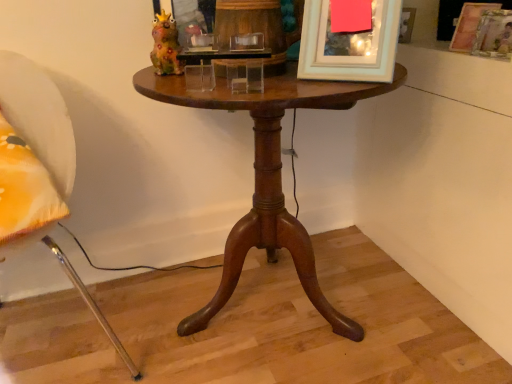
This screenshot has height=384, width=512. Describe the element at coordinates (39, 117) in the screenshot. I see `white fabric chair at left` at that location.

What do you see at coordinates (349, 44) in the screenshot?
I see `white matte picture frame at upper center, the first picture frame viewed from the left` at bounding box center [349, 44].

Measure the distance between point (x=307, y=276) and camera.

Point (x=307, y=276) and camera are 1.16 meters apart.

In order to face wooden picture frame at upper right, which is counted as the first picture frame, starting from the right, should I rotate leftwards or rightwards?

You should rotate right by 30.057 degrees.

Where is `wooden picture frame at upper right, the 3th picture frame in the front-to-back sequence`? This screenshot has width=512, height=384. wooden picture frame at upper right, the 3th picture frame in the front-to-back sequence is located at coordinates (469, 25).

This screenshot has height=384, width=512. Identify the location of white fabric chair at left. (39, 117).

Considering the relative positions of white fabric chair at left and mahogany wood table at center in the image provided, is white fabric chair at left to the right of mahogany wood table at center from the viewer's perspective?

No.

Which is correct: white fabric chair at left is inside mahogany wood table at center, or outside of it?

white fabric chair at left exists outside the volume of mahogany wood table at center.

Considering the relative sizes of white fabric chair at left and mahogany wood table at center in the image provided, is white fabric chair at left wider than mahogany wood table at center?

Yes.

Who is shorter, white fabric chair at left or mahogany wood table at center?

mahogany wood table at center is shorter.

Between wooden picture frame at upper right, the 3th picture frame in the front-to-back sequence, and wooden picture frame at upper right, arranged as the 3th picture frame when viewed from the left, which one appears on the right side from the viewer's perspective?

From the viewer's perspective, wooden picture frame at upper right, arranged as the 3th picture frame when viewed from the left, appears more on the right side.

Is wooden picture frame at upper right, the second picture frame when ordered from left to right, beside wooden picture frame at upper right, the 2th picture frame from the back?

Yes.

Looking at this image, from a real-world perspective, is wooden picture frame at upper right, which ranks as the second picture frame in right-to-left order, over wooden picture frame at upper right, positioned as the 2th picture frame in front-to-back order?

No, from a real-world perspective, wooden picture frame at upper right, which ranks as the second picture frame in right-to-left order, is not above wooden picture frame at upper right, positioned as the 2th picture frame in front-to-back order.

Can you tell me how much wooden picture frame at upper right, the 3th picture frame in the front-to-back sequence, and wooden picture frame at upper right, positioned as the 2th picture frame in front-to-back order, differ in facing direction?

The facing directions of wooden picture frame at upper right, the 3th picture frame in the front-to-back sequence, and wooden picture frame at upper right, positioned as the 2th picture frame in front-to-back order, are 2.12 degrees apart.

Which object is closer to the camera taking this photo, wooden picture frame at upper right, which ranks as the second picture frame in right-to-left order, or white fabric chair at left?

white fabric chair at left is closer to the camera.

Looking at this image, is wooden picture frame at upper right, the 3th picture frame in the front-to-back sequence, taller or shorter than white fabric chair at left?

Clearly, wooden picture frame at upper right, the 3th picture frame in the front-to-back sequence, is shorter compared to white fabric chair at left.

Measure the distance between wooden picture frame at upper right, the 3th picture frame in the front-to-back sequence, and white fabric chair at left.

1.05 meters.

Is wooden picture frame at upper right, the 1th picture frame from the back, aimed at white fabric chair at left?

No, wooden picture frame at upper right, the 1th picture frame from the back, is not turned towards white fabric chair at left.

Does white fabric chair at left have a lesser width compared to wooden picture frame at upper right, the 1th picture frame from the back?

Incorrect, the width of white fabric chair at left is not less than that of wooden picture frame at upper right, the 1th picture frame from the back.

Is white fabric chair at left in contact with wooden picture frame at upper right, the second picture frame when ordered from left to right?

No, white fabric chair at left is not making contact with wooden picture frame at upper right, the second picture frame when ordered from left to right.

From the image's perspective, which is above, white fabric chair at left or wooden picture frame at upper right, which ranks as the second picture frame in right-to-left order?

wooden picture frame at upper right, which ranks as the second picture frame in right-to-left order.

How distant is white fabric chair at left from wooden picture frame at upper right, which ranks as the second picture frame in right-to-left order?

white fabric chair at left and wooden picture frame at upper right, which ranks as the second picture frame in right-to-left order, are 1.05 meters apart.

Which of these two, mahogany wood table at center or wooden picture frame at upper right, the 3th picture frame in the front-to-back sequence, is smaller?

wooden picture frame at upper right, the 3th picture frame in the front-to-back sequence, is smaller.

Is mahogany wood table at center oriented away from wooden picture frame at upper right, which ranks as the second picture frame in right-to-left order?

No.

Are mahogany wood table at center and wooden picture frame at upper right, the second picture frame when ordered from left to right, located far from each other?

Actually, mahogany wood table at center and wooden picture frame at upper right, the second picture frame when ordered from left to right, are a little close together.

Considering the points (217, 88) and (457, 37), which point is in front, point (217, 88) or point (457, 37)?

Positioned in front is point (217, 88).

How different are the orientations of wooden picture frame at upper right, the second picture frame when ordered from left to right, and mahogany wood table at center in degrees?

The angular difference between wooden picture frame at upper right, the second picture frame when ordered from left to right, and mahogany wood table at center is 64 degrees.

From a real-world perspective, is wooden picture frame at upper right, the 3th picture frame in the front-to-back sequence, physically below mahogany wood table at center?

No.

Is wooden picture frame at upper right, which ranks as the second picture frame in right-to-left order, surrounding mahogany wood table at center?

No, mahogany wood table at center is not inside wooden picture frame at upper right, which ranks as the second picture frame in right-to-left order.

Are wooden picture frame at upper right, the 3th picture frame in the front-to-back sequence, and mahogany wood table at center located far from each other?

No.

Would you say white matte picture frame at upper center, the 1th picture frame viewed from the front, contains white fabric chair at left?

No.

From a real-world perspective, is white matte picture frame at upper center, the 1th picture frame viewed from the front, beneath white fabric chair at left?

No, from a real-world perspective, white matte picture frame at upper center, the 1th picture frame viewed from the front, is not under white fabric chair at left.

Considering the relative sizes of white matte picture frame at upper center, acting as the 3th picture frame starting from the right, and white fabric chair at left in the image provided, is white matte picture frame at upper center, acting as the 3th picture frame starting from the right, thinner than white fabric chair at left?

Indeed, white matte picture frame at upper center, acting as the 3th picture frame starting from the right, has a lesser width compared to white fabric chair at left.

Which object is further away from the camera, white matte picture frame at upper center, acting as the 3th picture frame starting from the right, or white fabric chair at left?

white matte picture frame at upper center, acting as the 3th picture frame starting from the right, is further away from the camera.

The height and width of the screenshot is (384, 512). I want to click on table directly beneath the white fabric chair at left (from a real-world perspective), so click(x=268, y=177).

From the image's perspective, starting from the wooden picture frame at upper right, the second picture frame when ordered from left to right, which picture frame is the 1st one below? Please provide its 2D coordinates.

[(494, 35)]

From the image, which object appears to be nearer to wooden picture frame at upper right, which ranks as the second picture frame in right-to-left order, mahogany wood table at center or white fabric chair at left?

mahogany wood table at center.

Considering their positions, is wooden picture frame at upper right, the second picture frame when ordered from left to right, positioned closer to white fabric chair at left than mahogany wood table at center?

The object closer to white fabric chair at left is mahogany wood table at center.

From the image, which object appears to be farther from white fabric chair at left, white matte picture frame at upper center, acting as the 3th picture frame starting from the right, or wooden picture frame at upper right, arranged as the 3th picture frame when viewed from the left?

Based on the image, wooden picture frame at upper right, arranged as the 3th picture frame when viewed from the left, appears to be further to white fabric chair at left.

From the image, which object appears to be farther from wooden picture frame at upper right, arranged as the 3th picture frame when viewed from the left, mahogany wood table at center or white matte picture frame at upper center, the 1th picture frame viewed from the front?

Among the two, mahogany wood table at center is located further to wooden picture frame at upper right, arranged as the 3th picture frame when viewed from the left.

Looking at the image, which one is located further to wooden picture frame at upper right, the 2th picture frame from the back, white fabric chair at left or white matte picture frame at upper center, the 1th picture frame viewed from the front?

white fabric chair at left is positioned further to the anchor wooden picture frame at upper right, the 2th picture frame from the back.

From the image, which object appears to be nearer to mahogany wood table at center, wooden picture frame at upper right, the 1th picture frame from the back, or wooden picture frame at upper right, which is counted as the first picture frame, starting from the right?

Based on the image, wooden picture frame at upper right, which is counted as the first picture frame, starting from the right, appears to be nearer to mahogany wood table at center.

When comparing their distances from wooden picture frame at upper right, positioned as the 2th picture frame in front-to-back order, does white fabric chair at left or wooden picture frame at upper right, which ranks as the second picture frame in right-to-left order, seem further?

Among the two, white fabric chair at left is located further to wooden picture frame at upper right, positioned as the 2th picture frame in front-to-back order.

Considering their positions, is wooden picture frame at upper right, the second picture frame when ordered from left to right, positioned closer to white fabric chair at left than white matte picture frame at upper center, the 1th picture frame viewed from the front?

Based on the image, white matte picture frame at upper center, the 1th picture frame viewed from the front, appears to be nearer to white fabric chair at left.

At what (x,y) coordinates should I click in order to perform the action: click on picture frame between white matte picture frame at upper center, positioned as the 3th picture frame in back-to-front order, and wooden picture frame at upper right, positioned as the 2th picture frame in front-to-back order, from left to right. Please return your answer as a coordinate pair (x, y). The image size is (512, 384). Looking at the image, I should click on (469, 25).

Where is `table between white fabric chair at left and wooden picture frame at upper right, arranged as the 3th picture frame when viewed from the left, in the horizontal direction`? This screenshot has height=384, width=512. table between white fabric chair at left and wooden picture frame at upper right, arranged as the 3th picture frame when viewed from the left, in the horizontal direction is located at coordinates (268, 177).

I want to click on picture frame between mahogany wood table at center and wooden picture frame at upper right, the second picture frame when ordered from left to right, so click(349, 44).

Where is `table located between white fabric chair at left and white matte picture frame at upper center, acting as the 3th picture frame starting from the right, in the left-right direction`? The height and width of the screenshot is (384, 512). table located between white fabric chair at left and white matte picture frame at upper center, acting as the 3th picture frame starting from the right, in the left-right direction is located at coordinates (268, 177).